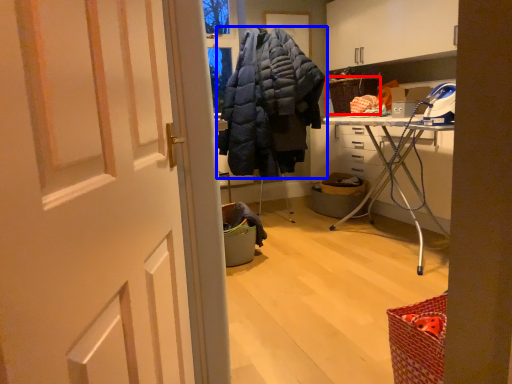
Question: Which object appears closest to the camera in this image, picnic basket (highlighted by a red box) or jacket (highlighted by a blue box)?

Choices:
 (A) picnic basket
 (B) jacket

Answer: (B)